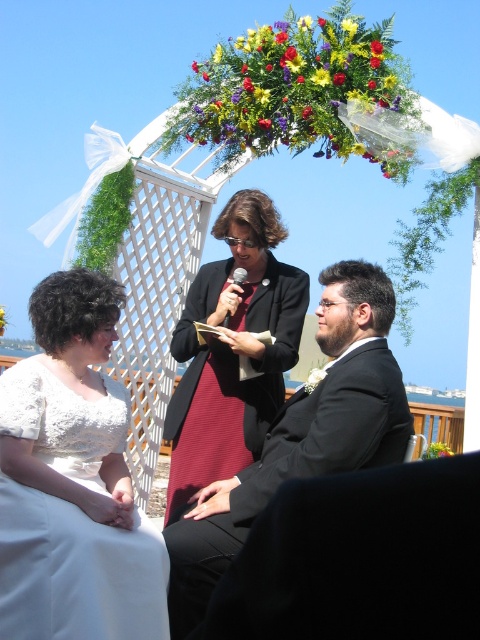
You are a photographer at the wedding. You need to position the black satin suit at center and the maroon textured dress at center so that they are both visible in the photo. Where should you place them relative to each other to ensure both are visible?

Place the black satin suit at center to the right of the maroon textured dress at center so that both are visible in the photo.

You are a photographer at the wedding ceremony. You need to position yourself to capture a shot of the white lace dress at lower left. According to the scene description, where should you stand to ensure the dress is in the frame?

The white lace dress at lower left is located at point (72, 481), so you should position yourself to the lower left area of the scene to capture the dress in the frame.